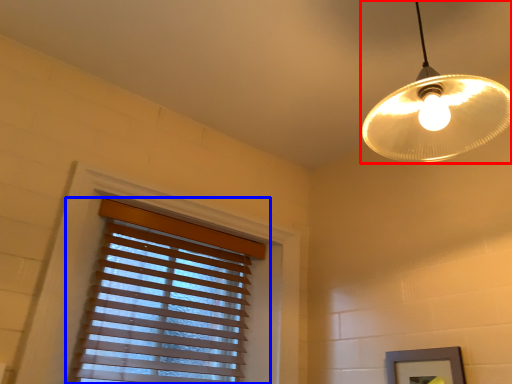
Question: Which object is further to the camera taking this photo, lamp (highlighted by a red box) or window blind (highlighted by a blue box)?

Choices:
 (A) lamp
 (B) window blind

Answer: (B)